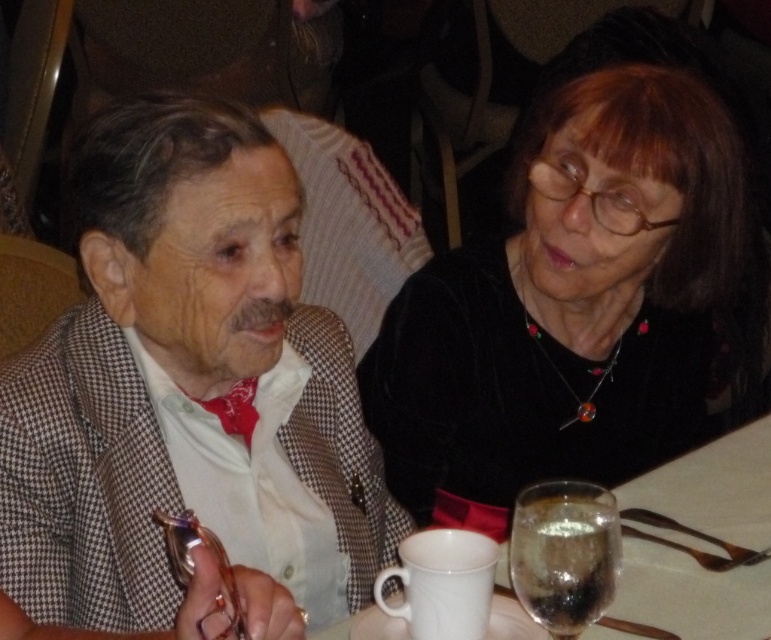
Which of these two, checkered fabric suit at left or clear glass wine glass at lower right, stands shorter?

Standing shorter between the two is clear glass wine glass at lower right.

Which is in front, point (27, 449) or point (537, 566)?

Point (537, 566) is more forward.

Identify the location of checkered fabric suit at left. (174, 371).

This screenshot has width=771, height=640. What are the coordinates of `checkered fabric suit at left` in the screenshot? It's located at (174, 371).

In the scene shown: Is checkered fabric suit at left bigger than white ceramic mug at lower center?

Correct, checkered fabric suit at left is larger in size than white ceramic mug at lower center.

Is checkered fabric suit at left taller than white ceramic mug at lower center?

Yes, checkered fabric suit at left is taller than white ceramic mug at lower center.

Is point (44, 364) farther from camera compared to point (731, 589)?

No.

Locate an element on the screen. Image resolution: width=771 pixels, height=640 pixels. checkered fabric suit at left is located at coordinates (174, 371).

Is black velvet sweater at upper right wider than white ceramic mug at lower center?

Correct, the width of black velvet sweater at upper right exceeds that of white ceramic mug at lower center.

Does black velvet sweater at upper right appear over white ceramic mug at lower center?

Correct, black velvet sweater at upper right is located above white ceramic mug at lower center.

Measure the distance between black velvet sweater at upper right and camera.

3.88 feet

The width and height of the screenshot is (771, 640). I want to click on black velvet sweater at upper right, so click(571, 300).